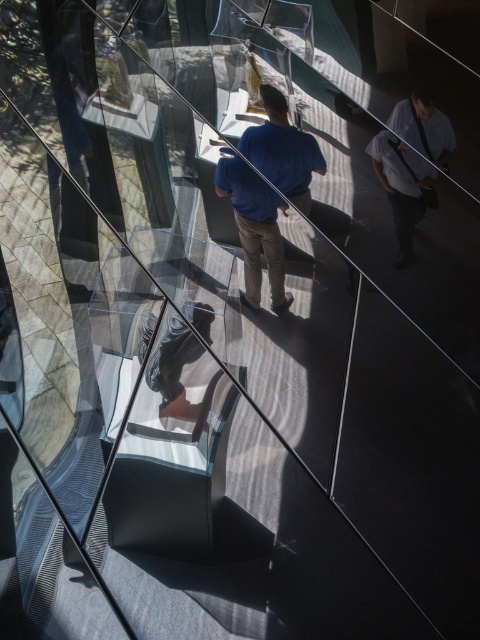
Question: Can you confirm if blue cotton shirt at center is positioned above light blue shirt at right?

Choices:
 (A) yes
 (B) no

Answer: (A)

Question: Which point is closer to the camera?

Choices:
 (A) light blue shirt at right
 (B) blue cotton shirt at center

Answer: (A)

Question: Does blue cotton shirt at center have a lesser width compared to light blue shirt at right?

Choices:
 (A) no
 (B) yes

Answer: (A)

Question: Is blue cotton shirt at center further to the viewer compared to light blue shirt at right?

Choices:
 (A) yes
 (B) no

Answer: (A)